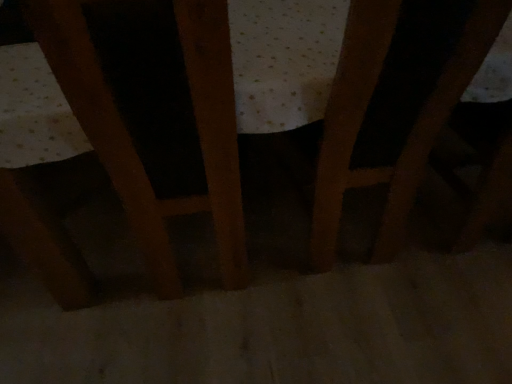
Where is `wooden chair at center`? wooden chair at center is located at coordinates pos(131,139).

The image size is (512, 384). Describe the element at coordinates (131, 139) in the screenshot. I see `wooden chair at center` at that location.

The image size is (512, 384). Find the location of `wooden chair at center`. wooden chair at center is located at coordinates (131, 139).